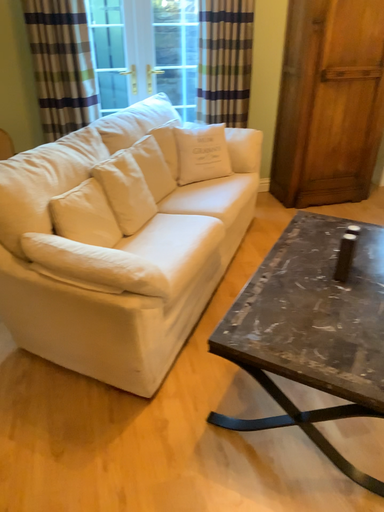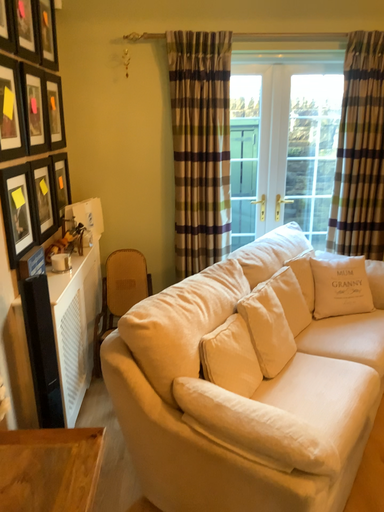
Question: How did the camera likely rotate when shooting the video?

Choices:
 (A) rotated left
 (B) rotated right

Answer: (A)